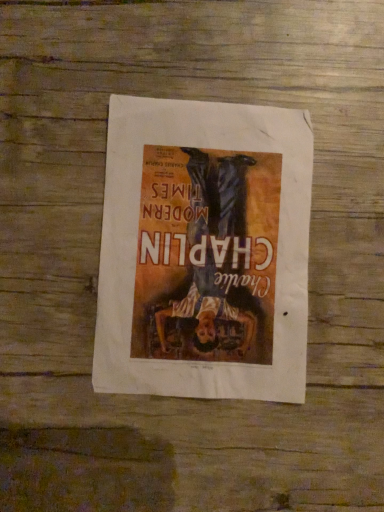
Image resolution: width=384 pixels, height=512 pixels. Find the location of `free spot above matte paper poster at center (from a real-world perspective)`. free spot above matte paper poster at center (from a real-world perspective) is located at coordinates (210, 247).